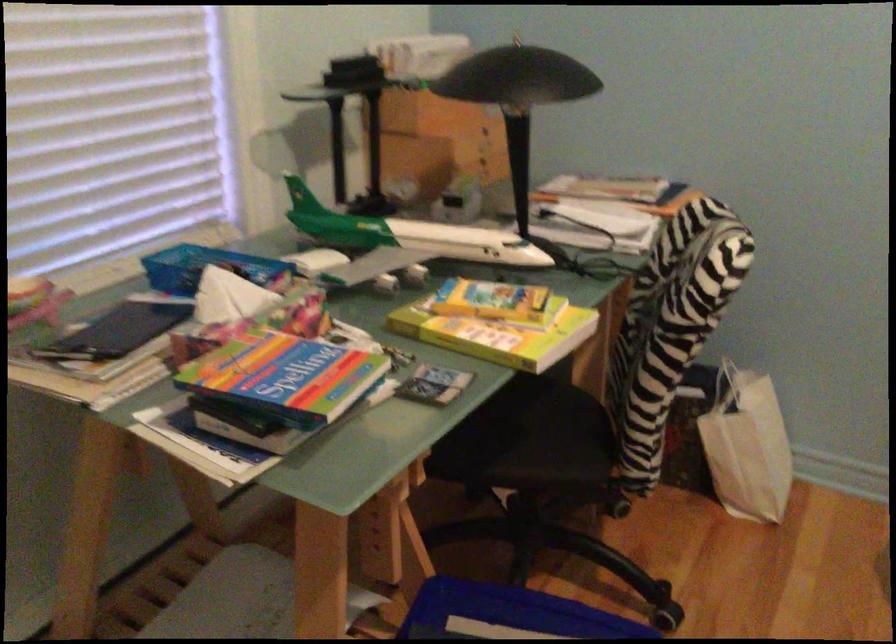
Locate an element on the screen. This screenshot has width=896, height=644. blue plastic basket is located at coordinates (204, 267).